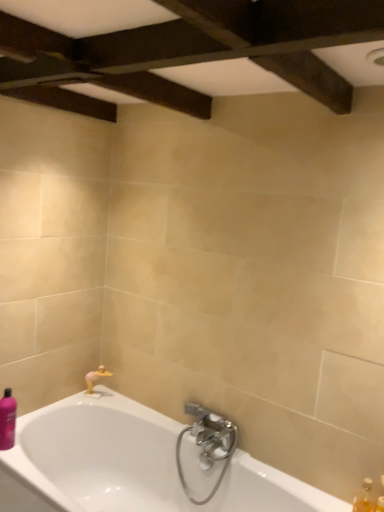
Question: Is translucent amber bottle at lower right wider or thinner than purple glossy bottle at lower left, the 1th toiletry from the left?

Choices:
 (A) wide
 (B) thin

Answer: (B)

Question: From a real-world perspective, is translucent amber bottle at lower right positioned above or below purple glossy bottle at lower left, acting as the 2th toiletry starting from the bottom?

Choices:
 (A) below
 (B) above

Answer: (A)

Question: Estimate the real-world distances between objects in this image. Which object is closer to the white glossy bathtub at lower left?

Choices:
 (A) translucent amber bottle at lower right
 (B) translucent plastic soap at lower right, the first toiletry ordered from the bottom
 (C) purple glossy bottle at lower left, acting as the 2th toiletry starting from the bottom

Answer: (C)

Question: Estimate the real-world distances between objects in this image. Which object is farther from the translucent plastic soap at lower right, the 2th toiletry in the left-to-right sequence?

Choices:
 (A) translucent amber bottle at lower right
 (B) purple glossy bottle at lower left, the 1th toiletry in the back-to-front sequence
 (C) white glossy bathtub at lower left

Answer: (B)